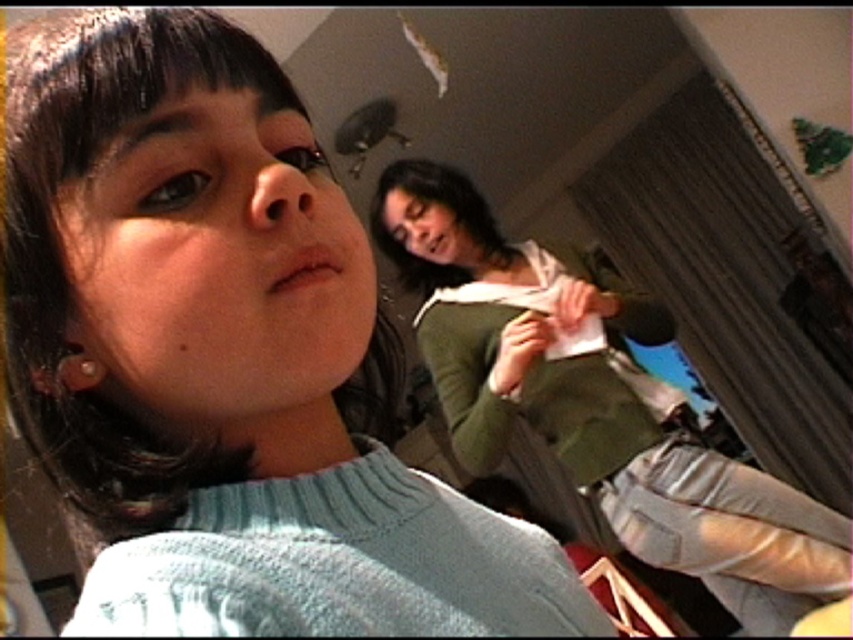
You are an interior designer analyzing the spatial arrangement of the room. Considering the placement of the light blue sweater at upper left and the green matte sweater at upper right, which one is closer to the viewer?

The light blue sweater at upper left is closer to the viewer because it is positioned over the green matte sweater at upper right.

You are an interior designer assessing the spatial arrangement of the room. The light blue sweater at upper left and green matte sweater at upper right are part of the decor. Which sweater takes up more visual space in the room?

The green matte sweater at upper right takes up more visual space because it is larger than the light blue sweater at upper left.

You are standing in the room and want to hand a pen to both people. The light blue sweater at upper left and the green matte sweater at upper right are in your view. Which person should you approach first if you want to give the pen to the one closer to the left side of the room?

You should approach the light blue sweater at upper left first because it is positioned to the left of the green matte sweater at upper right, making it closer to the left side of the room.